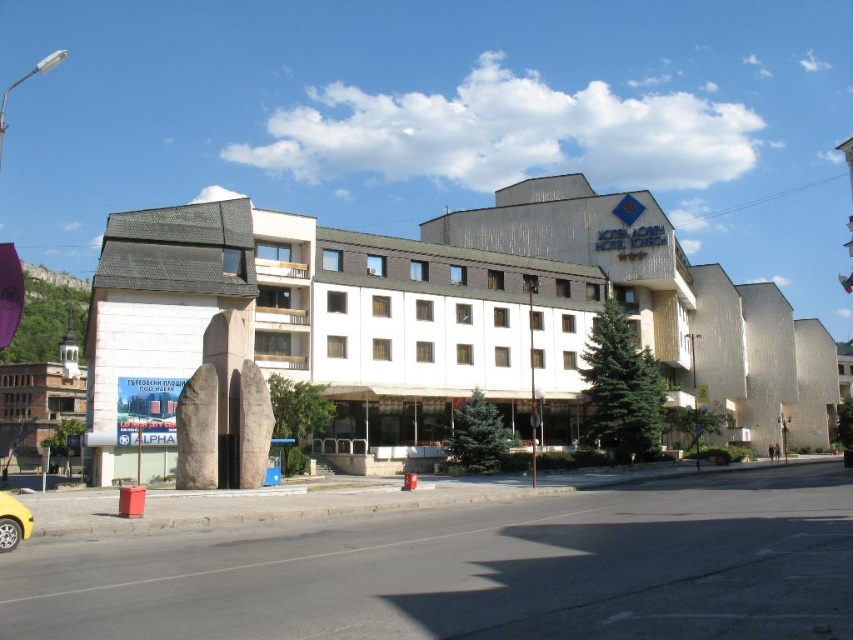
Can you confirm if white concrete building at center is bigger than yellow matte taxi at lower left?

Yes.

Is point (459, 317) positioned behind point (15, 518)?

Yes, point (459, 317) is behind point (15, 518).

Between point (321, 362) and point (15, 520), which one is positioned in front?

Point (15, 520) is more forward.

This screenshot has height=640, width=853. Find the location of `white concrete building at center`. white concrete building at center is located at coordinates (451, 316).